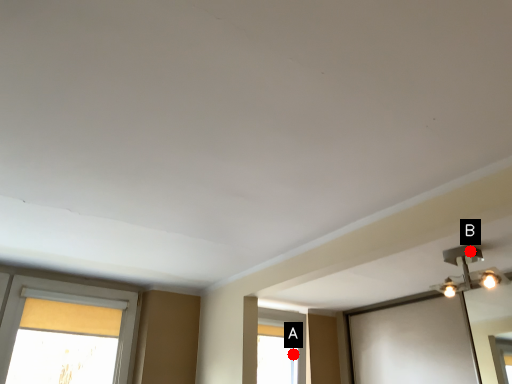
Question: Two points are circled on the image, labeled by A and B beside each circle. Among these points, which one is nearest to the camera?

Choices:
 (A) A is closer
 (B) B is closer

Answer: (B)